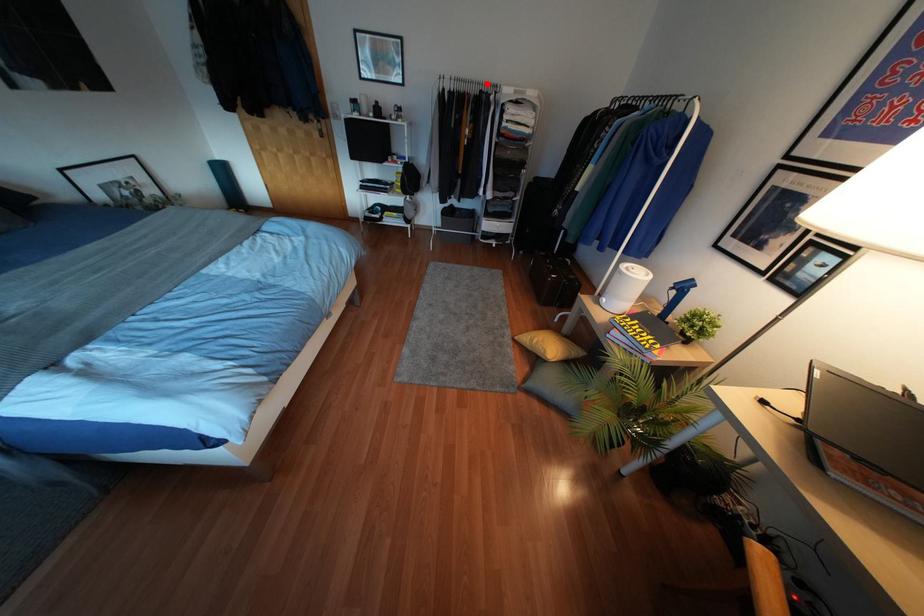
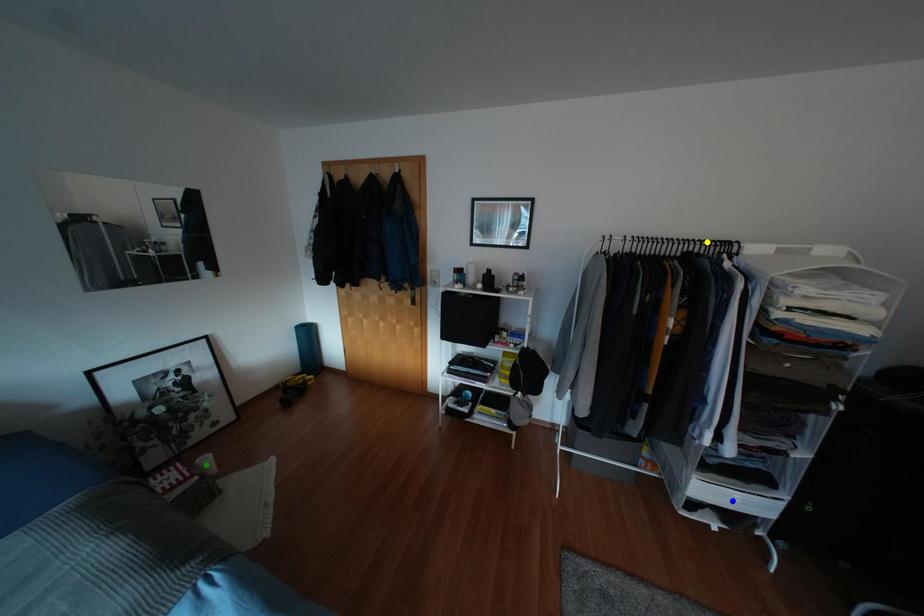
Question: I am providing you with two images of the same scene from different viewpoints. A red point is marked on the first image. You are given multiple points on the second image. Which point in image 2 is actually the same real-world point as the red point in image 1?

Choices:
 (A) yellow point
 (B) green point
 (C) blue point

Answer: (A)